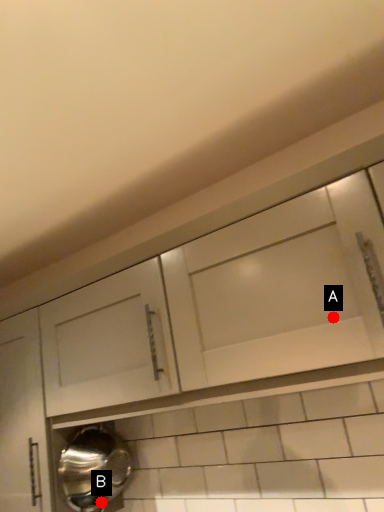
Question: Two points are circled on the image, labeled by A and B beside each circle. Among these points, which one is farthest from the camera?

Choices:
 (A) A is further
 (B) B is further

Answer: (B)